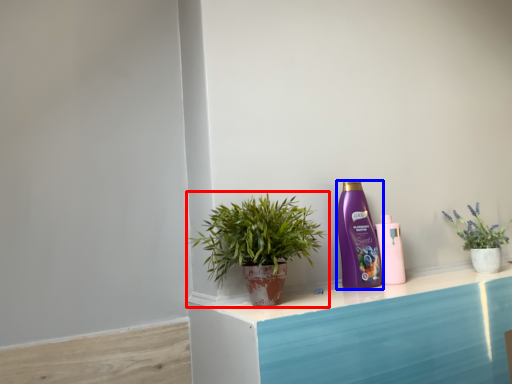
Question: Among these objects, which one is farthest to the camera, houseplant (highlighted by a red box) or bottle (highlighted by a blue box)?

Choices:
 (A) houseplant
 (B) bottle

Answer: (B)